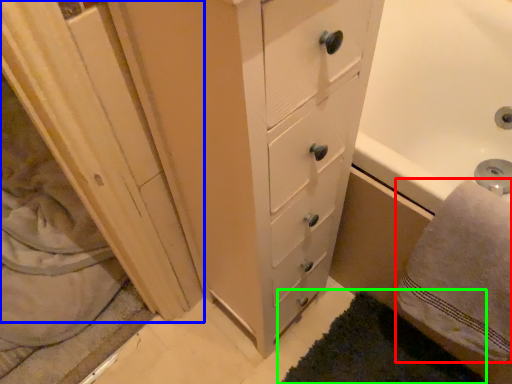
Question: Based on their relative distances, which object is farther from bath towel (highlighted by a red box)? Choose from screen door (highlighted by a blue box) and bath mat (highlighted by a green box).

Choices:
 (A) screen door
 (B) bath mat

Answer: (A)